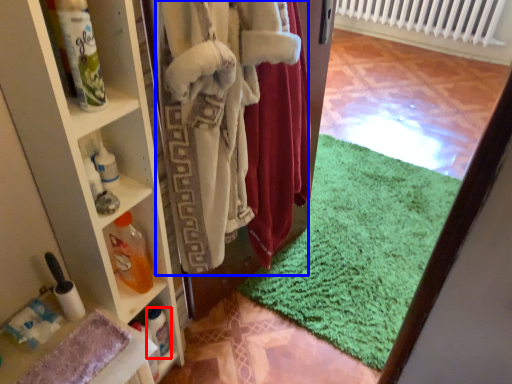
Question: Which of the following is the farthest to the observer, bottle (highlighted by a red box) or clothing (highlighted by a blue box)?

Choices:
 (A) bottle
 (B) clothing

Answer: (A)